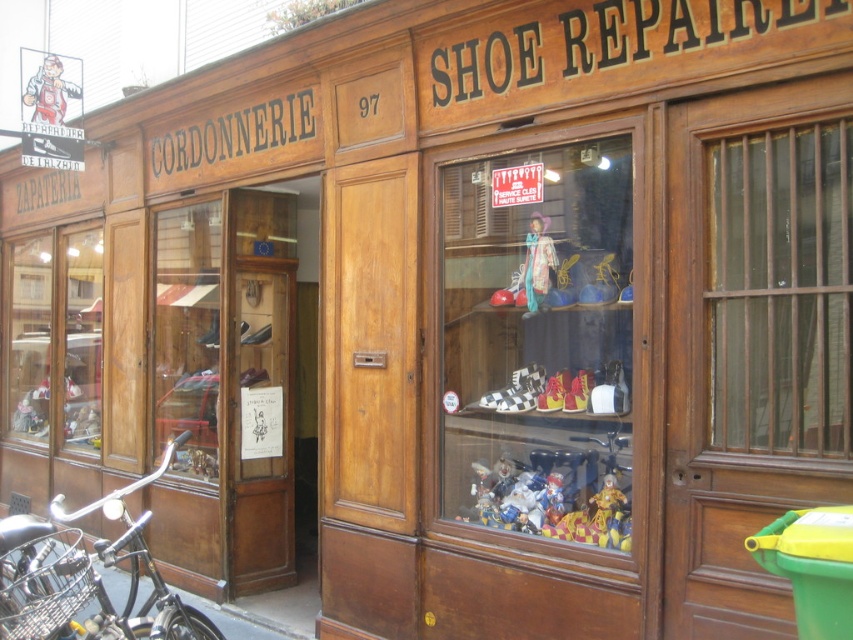
You are a customer standing outside the shoe repair shop. You see the transparent glass window at right and the multicolored plastic clown at center. Which object is higher up in the shop?

The transparent glass window at right is located above the multicolored plastic clown at center, so it is higher up in the shop.

You are a customer entering the shoe repair shop and see the black matte bicycle at lower left and the multicolored plastic clown at center. Which object is positioned lower in the image?

The black matte bicycle at lower left is located below the multicolored plastic clown at center, so it is positioned lower in the image.

You are standing outside the shoe repair shop at number 97. You see a point at coordinates (538,340). What object is located at that point?

The point at coordinates (538,340) corresponds to the matte glass shop window at center.